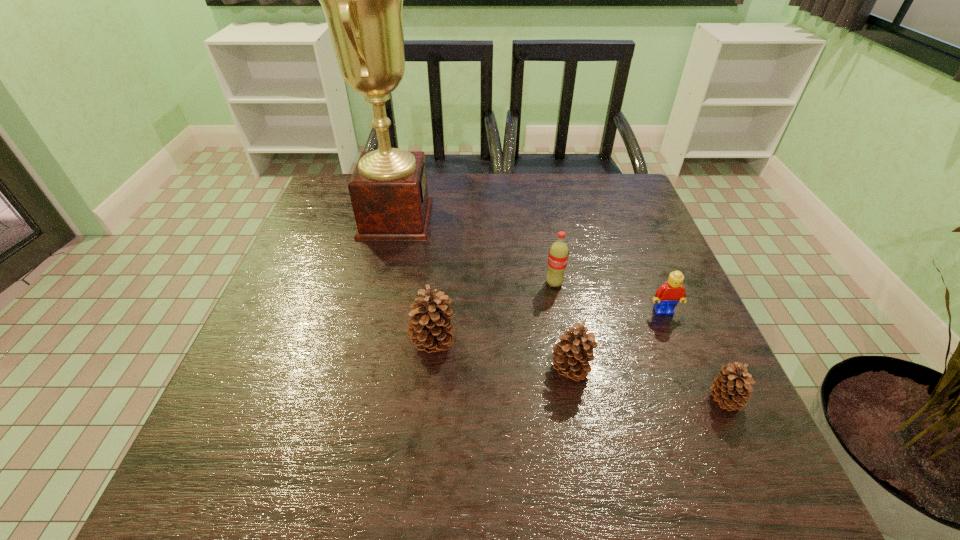
I want to click on vacant area between the farthest object and the soda, so click(x=475, y=251).

What are the coordinates of `free point between the shortest pinecone and the soda` in the screenshot? It's located at (639, 341).

At what (x,y) coordinates should I click in order to perform the action: click on empty space that is in between the shortest pinecone and the tallest object. Please return your answer as a coordinate pair (x, y). The image size is (960, 540). Looking at the image, I should click on (561, 309).

Locate an element on the screen. This screenshot has height=540, width=960. the fifth closest object to the trophy cup is located at coordinates (731, 388).

Select which object appears as the fourth closest to the fifth nearest object. Please provide its 2D coordinates. Your answer should be formatted as a tuple, i.e. [(x, y)], where the tuple contains the x and y coordinates of a point satisfying the conditions above.

[(362, 0)]

Image resolution: width=960 pixels, height=540 pixels. I want to click on pinecone object that ranks as the closest to the second shortest pinecone, so click(430, 329).

This screenshot has width=960, height=540. Identify the location of pinecone that is the second nearest to the fifth nearest object. (430, 329).

Identify the location of free space that satisfies the following two spatial constraints: 1. on the front side of the rightmost pinecone; 2. on the left side of the tallest pinecone. (427, 399).

The width and height of the screenshot is (960, 540). I want to click on vacant area that satisfies the following two spatial constraints: 1. on the back side of the leftmost pinecone; 2. on the plaque of the farthest object, so click(x=444, y=219).

Where is `free spot that satisfies the following two spatial constraints: 1. on the front-facing side of the Lego; 2. on the right side of the shortest pinecone`? free spot that satisfies the following two spatial constraints: 1. on the front-facing side of the Lego; 2. on the right side of the shortest pinecone is located at coordinates (700, 399).